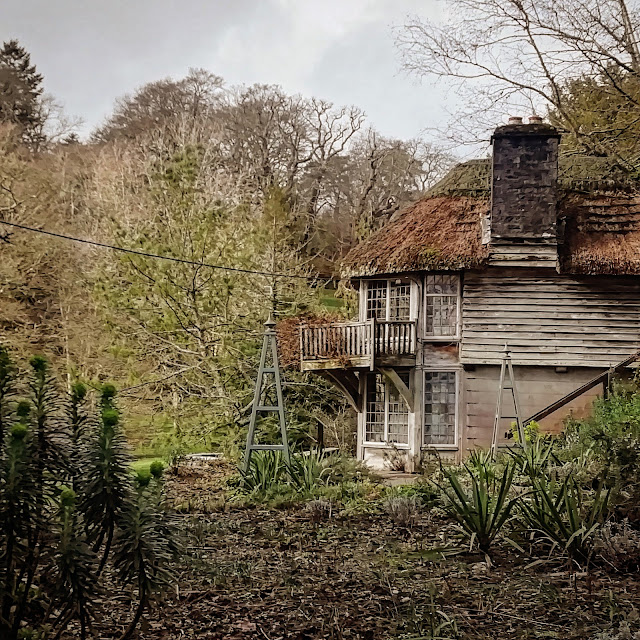
Find the location of a particular element. chimney is located at coordinates (529, 196).